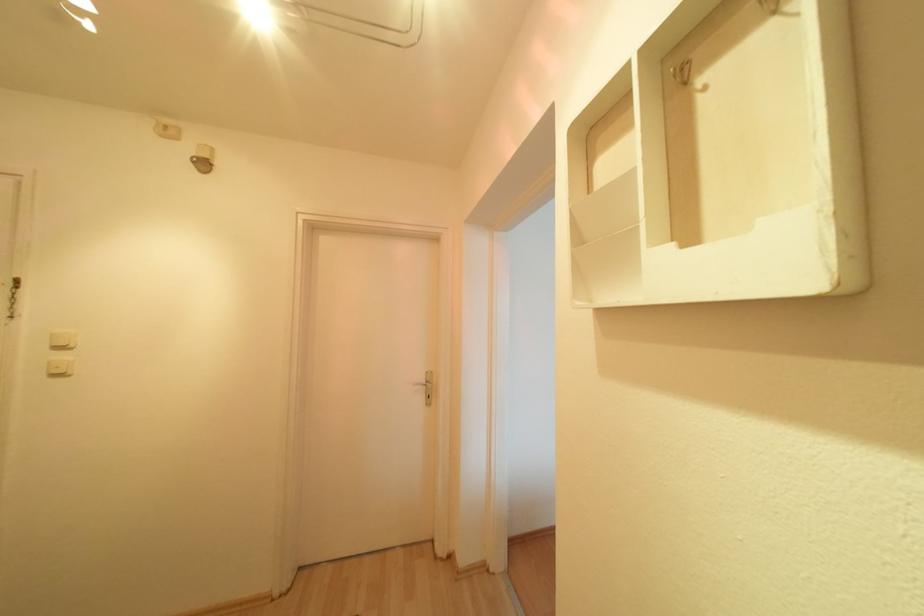
The height and width of the screenshot is (616, 924). I want to click on silver door handle, so click(x=427, y=387).